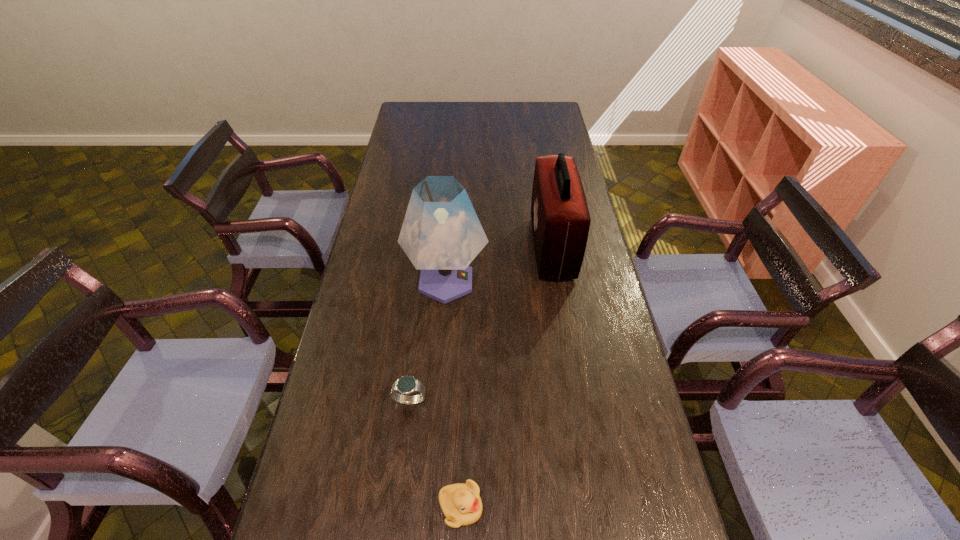
Locate an element on the screen. The width and height of the screenshot is (960, 540). lampshade is located at coordinates (441, 234).

I want to click on the rightmost object, so click(560, 218).

The width and height of the screenshot is (960, 540). In order to click on the second nearest object in this screenshot , I will do `click(406, 385)`.

This screenshot has width=960, height=540. What are the coordinates of `the nearest object` in the screenshot? It's located at (461, 504).

Locate an element on the screen. This screenshot has width=960, height=540. vacant area located 0.290m on the base of the lampshade is located at coordinates (577, 281).

Where is `vacant space located on the side of the first aid kit with the cross symbol`? The width and height of the screenshot is (960, 540). vacant space located on the side of the first aid kit with the cross symbol is located at coordinates click(x=515, y=247).

Identify the location of free space located on the side of the first aid kit with the cross symbol. Image resolution: width=960 pixels, height=540 pixels. (494, 247).

The image size is (960, 540). Find the location of `free space located 0.140m on the side of the first aid kit with the cross symbol`. free space located 0.140m on the side of the first aid kit with the cross symbol is located at coordinates (492, 247).

Identify the location of free point located on the left of the watch. (331, 400).

Locate an element on the screen. vacant point located on the front-facing side of the nearest object is located at coordinates (561, 507).